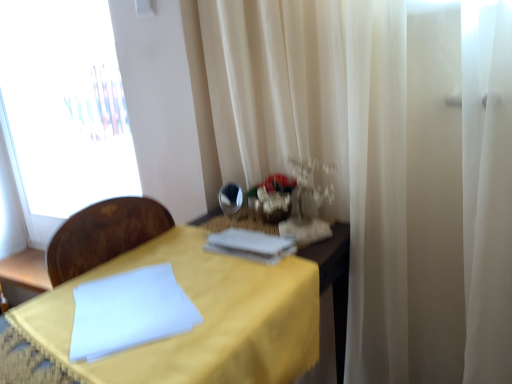
You are a GUI agent. You are given a task and a screenshot of the screen. Output one action in this format:
    pyautogui.click(x=<x>, y=<y>)
    Task: Click on the empty space that is to the right of white paper at center
    This screenshot has width=512, height=384.
    Given the screenshot: What is the action you would take?
    pyautogui.click(x=316, y=243)